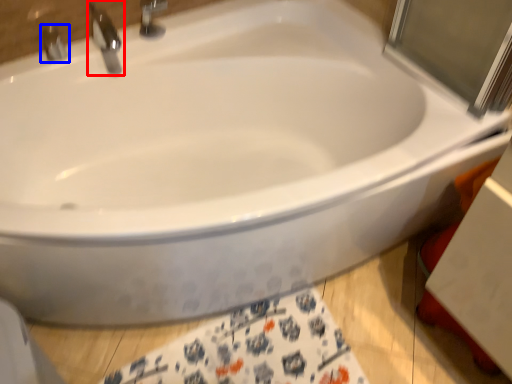
Question: Among these objects, which one is nearest to the camera, tap (highlighted by a red box) or tap (highlighted by a blue box)?

Choices:
 (A) tap
 (B) tap

Answer: (A)